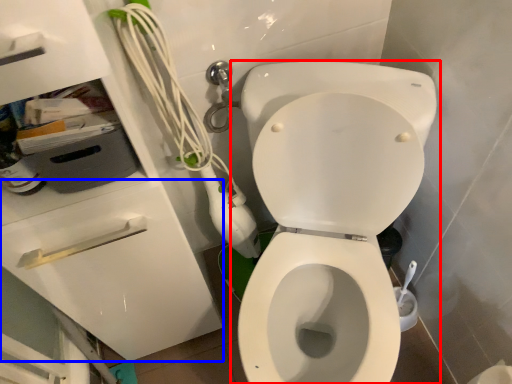
Question: Which object appears closest to the camera in this image, toilet (highlighted by a red box) or drawer (highlighted by a blue box)?

Choices:
 (A) toilet
 (B) drawer

Answer: (A)